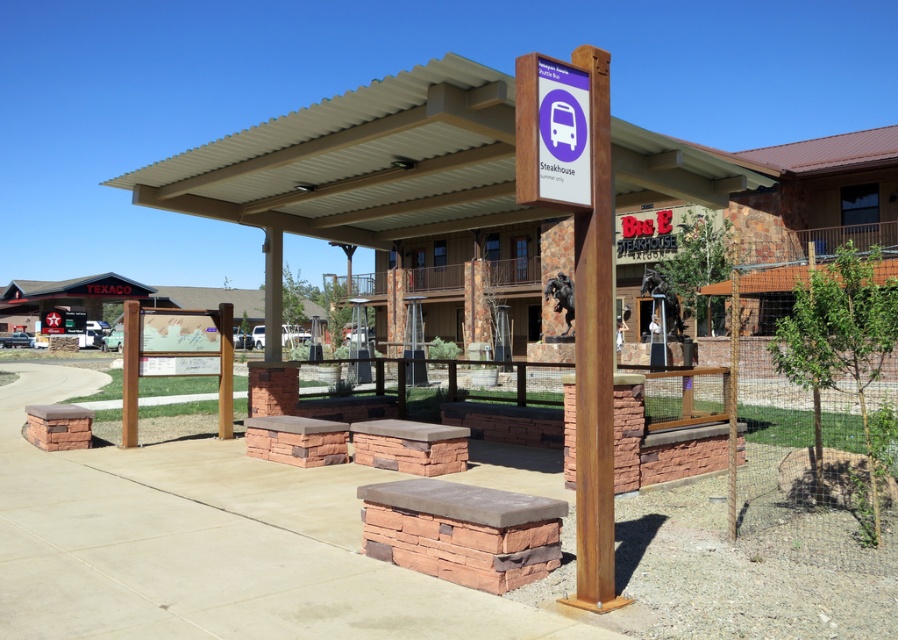
Which is behind, point (600, 248) or point (128, 364)?

The point (128, 364) is more distant.

Is point (584, 550) farther from camera compared to point (126, 419)?

No.

At what (x,y) coordinates should I click in order to perform the action: click on rustic wood signpost at center. Please return your answer as a coordinate pair (x, y). The width and height of the screenshot is (898, 640). Looking at the image, I should click on (594, 355).

Is point (596, 444) more distant than point (564, 198)?

No, (596, 444) is closer to viewer.

How distant is rustic wood signpost at center from purple matte sign at upper center?

rustic wood signpost at center is 32.10 centimeters away from purple matte sign at upper center.

Identify the location of rustic wood signpost at center. Image resolution: width=898 pixels, height=640 pixels. (594, 355).

You are a GUI agent. You are given a task and a screenshot of the screen. Output one action in this format:
    pyautogui.click(x=<x>, y=<y>)
    Task: Click on the rustic wood signpost at center
    The width and height of the screenshot is (898, 640).
    Given the screenshot: What is the action you would take?
    pyautogui.click(x=594, y=355)

Which is below, brown corrugated metal canopy at center or rustic wood signpost at center?

rustic wood signpost at center is below.

Is brown corrugated metal canopy at center smaller than rustic wood signpost at center?

No.

Is point (425, 156) positioned before point (597, 564)?

No, it is behind (597, 564).

The height and width of the screenshot is (640, 898). I want to click on brown corrugated metal canopy at center, so click(359, 163).